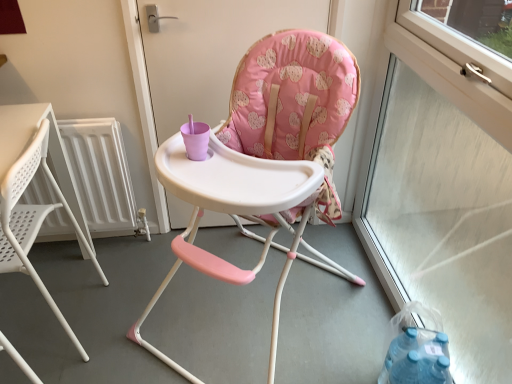
Locate an element on the screen. The height and width of the screenshot is (384, 512). vacant space to the left of matte plastic highchair at center, which is the 1th chair in right-to-left order is located at coordinates (131, 296).